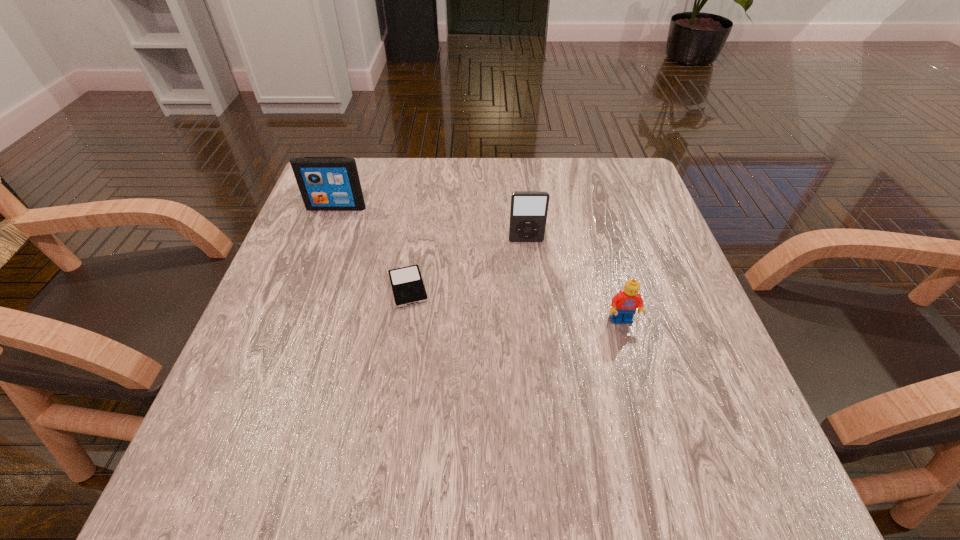
At what (x,y) coordinates should I click in order to perform the action: click on vacant space at the near right corner of the desktop. Please return your answer as a coordinate pair (x, y). Looking at the image, I should click on (737, 465).

You are a GUI agent. You are given a task and a screenshot of the screen. Output one action in this format:
    pyautogui.click(x=<x>, y=<y>)
    Task: Click on the free space between the rightmost object and the shortest iPod
    
    Given the screenshot: What is the action you would take?
    pyautogui.click(x=515, y=304)

Identify the location of free space between the rightmost object and the nearest iPod. (515, 304).

This screenshot has height=540, width=960. Identify the location of free point between the second iPod from left to right and the rightmost object. (515, 304).

Locate an element on the screen. The height and width of the screenshot is (540, 960). unoccupied position between the rightmost iPod and the rightmost object is located at coordinates 574,281.

Locate an element on the screen. unoccupied area between the second farthest iPod and the shortest object is located at coordinates (467, 264).

You are a GUI agent. You are given a task and a screenshot of the screen. Output one action in this format:
    pyautogui.click(x=<x>, y=<y>)
    Task: Click on the vacant area that lies between the nearest object and the leftmost object
    
    Given the screenshot: What is the action you would take?
    pyautogui.click(x=479, y=264)

Locate an element on the screen. vacant point located between the second farthest iPod and the rightmost object is located at coordinates (574, 281).

Find the location of a particular element. vacant space that is in between the second nearest iPod and the rightmost object is located at coordinates (574, 281).

Where is `free space between the farthest iPod and the shortest iPod`? The image size is (960, 540). free space between the farthest iPod and the shortest iPod is located at coordinates (372, 247).